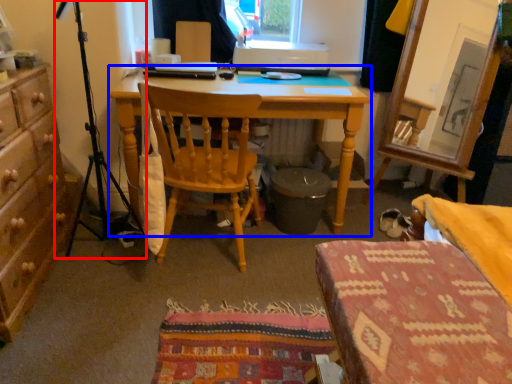
Question: Among these objects, which one is nearest to the camera, tripod (highlighted by a red box) or desk (highlighted by a blue box)?

Choices:
 (A) tripod
 (B) desk

Answer: (A)